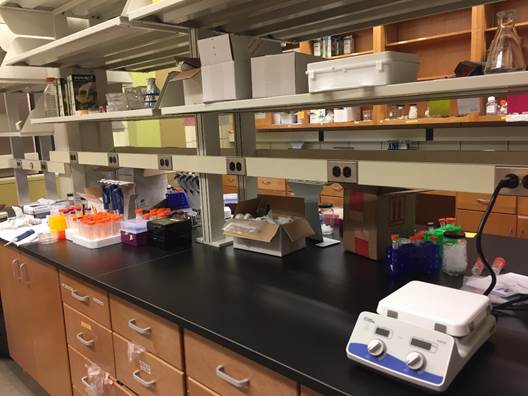
What are the coordinates of `base cabinet doors` in the screenshot? It's located at (41, 300), (6, 285), (520, 220), (506, 221), (330, 199), (341, 200), (276, 192), (262, 190), (227, 188).